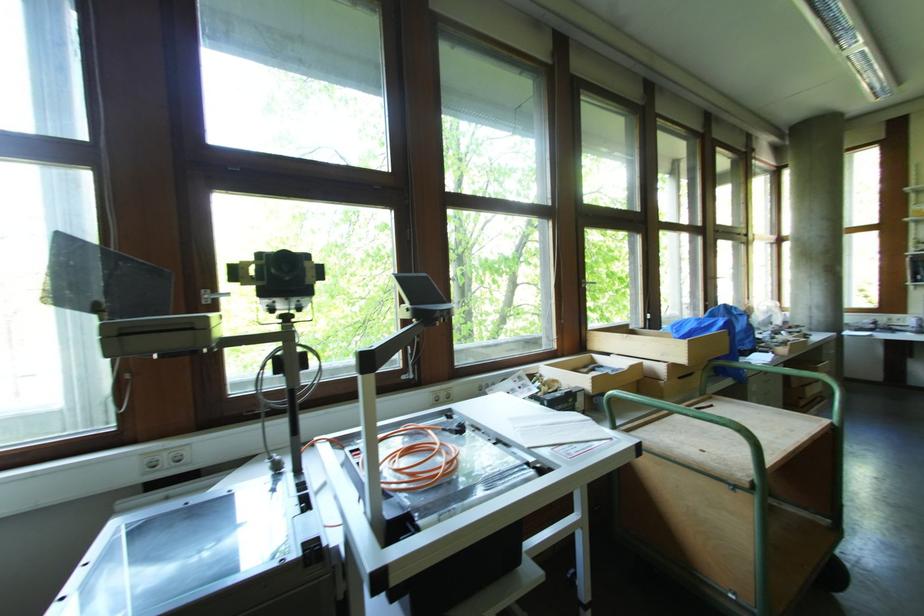
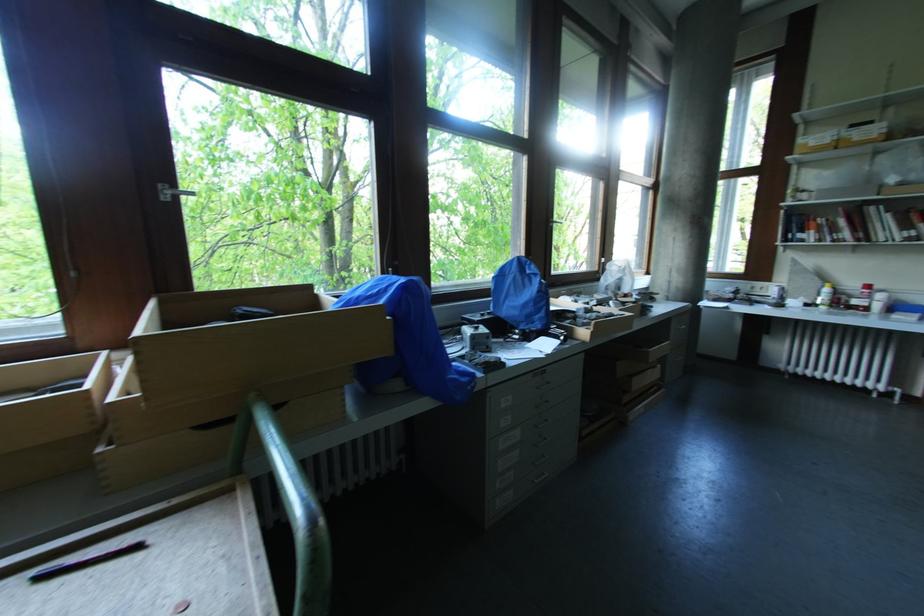
Find the pixel in the second image that matches point 714,408 in the first image.

(140, 549)